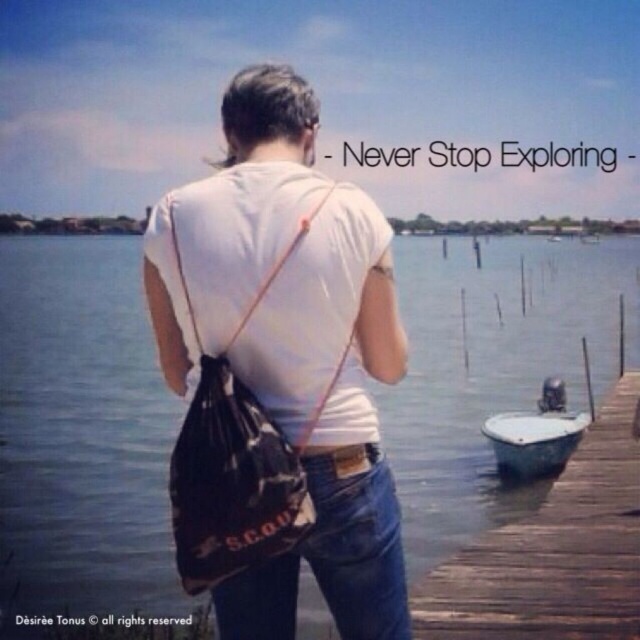
Question: Does wooden at right appear under black canvas bag at center?

Choices:
 (A) yes
 (B) no

Answer: (A)

Question: Among these objects, which one is farthest from the camera?

Choices:
 (A) wooden at right
 (B) jeans at center
 (C) green plastic boat at lower right

Answer: (C)

Question: Which point is closer to the camera?

Choices:
 (A) green plastic boat at lower right
 (B) wooden at right

Answer: (B)

Question: Which point is farther to the camera?

Choices:
 (A) (492, 417)
 (B) (180, 268)
 (C) (305, 560)
 (D) (621, 376)

Answer: (D)

Question: Can you confirm if blue water at center is wider than jeans at center?

Choices:
 (A) yes
 (B) no

Answer: (A)

Question: Is wooden at right smaller than green plastic boat at lower right?

Choices:
 (A) no
 (B) yes

Answer: (A)